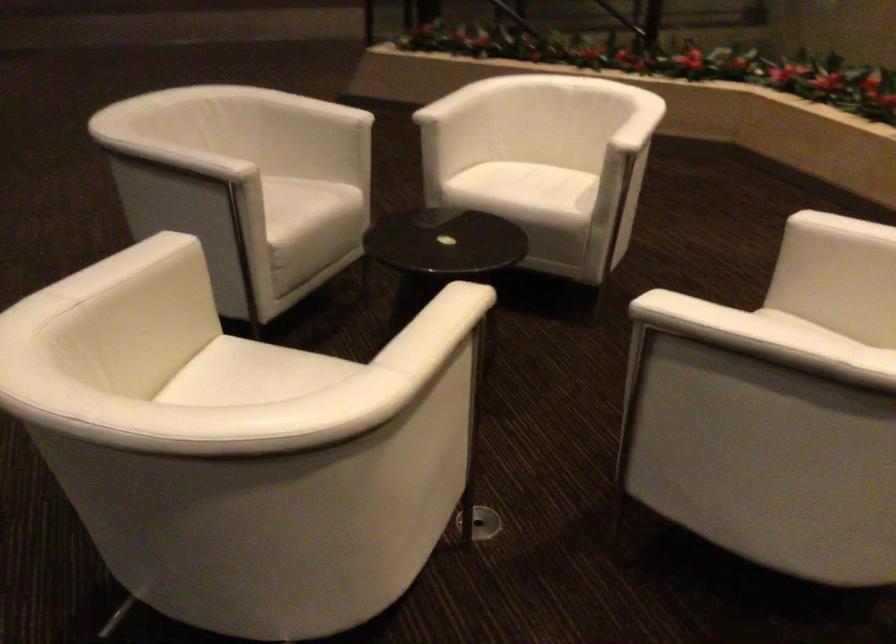
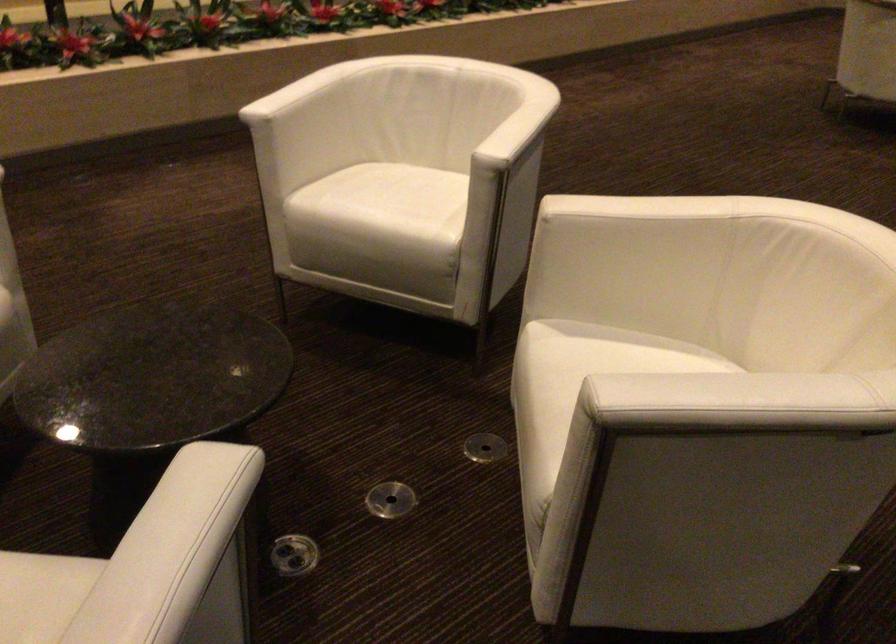
Question: I am providing you with two images of the same scene from different viewpoints. Which of the following objects are not visible in image2?

Choices:
 (A) white chair sitting surface
 (B) round floor cover
 (C) black makeup brush
 (D) white chair armrest

Answer: (A)